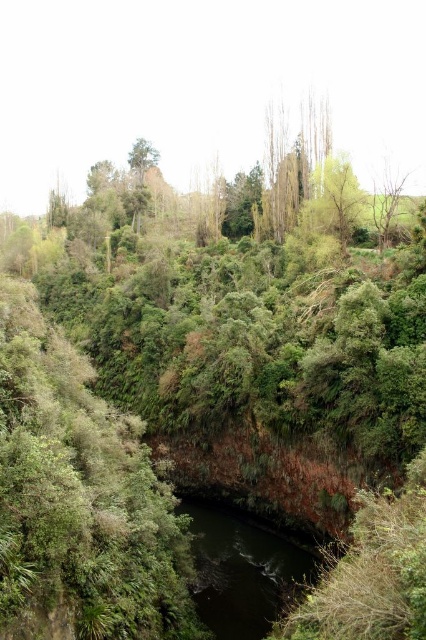
Based on the photo, which is more to the right, dark green water at center or green matte tree at upper center?

dark green water at center is more to the right.

Which of these two, dark green water at center or green matte tree at upper center, stands shorter?

With less height is dark green water at center.

This screenshot has width=426, height=640. I want to click on dark green water at center, so click(244, 568).